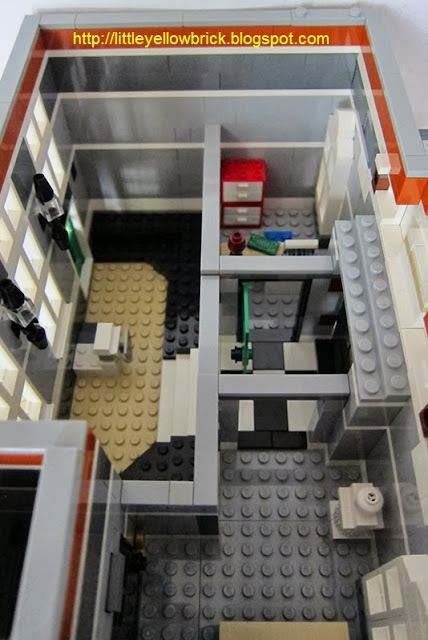
Where is `dresser`? The image size is (428, 640). dresser is located at coordinates (241, 195).